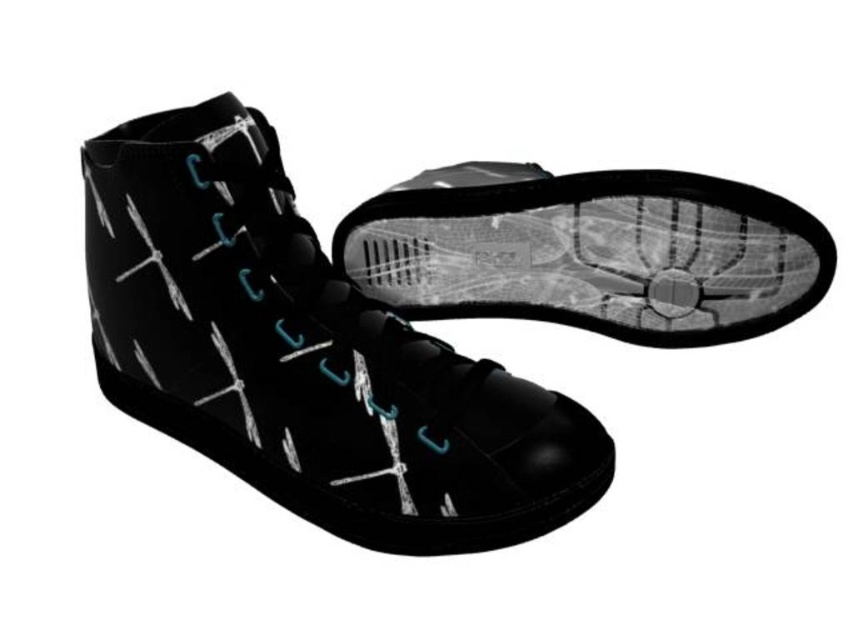
Question: Among these objects, which one is farthest from the camera?

Choices:
 (A) black matte shoe at center
 (B) black matte high-top boot at center

Answer: (A)

Question: Among these objects, which one is farthest from the camera?

Choices:
 (A) black matte high-top boot at center
 (B) black matte shoe at center

Answer: (B)

Question: Does black matte high-top boot at center appear under black matte shoe at center?

Choices:
 (A) yes
 (B) no

Answer: (A)

Question: Is black matte high-top boot at center below black matte shoe at center?

Choices:
 (A) yes
 (B) no

Answer: (A)

Question: Is black matte high-top boot at center positioned behind black matte shoe at center?

Choices:
 (A) yes
 (B) no

Answer: (B)